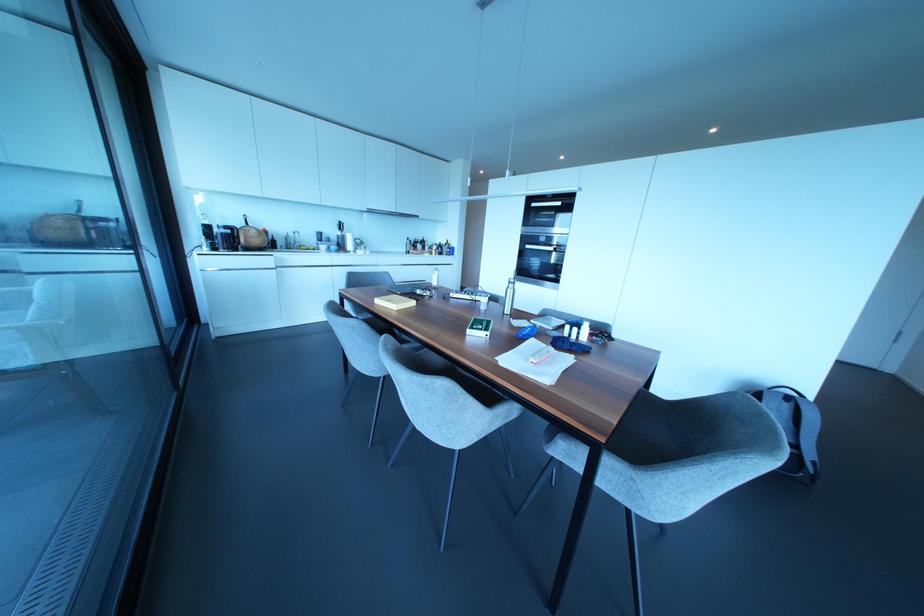
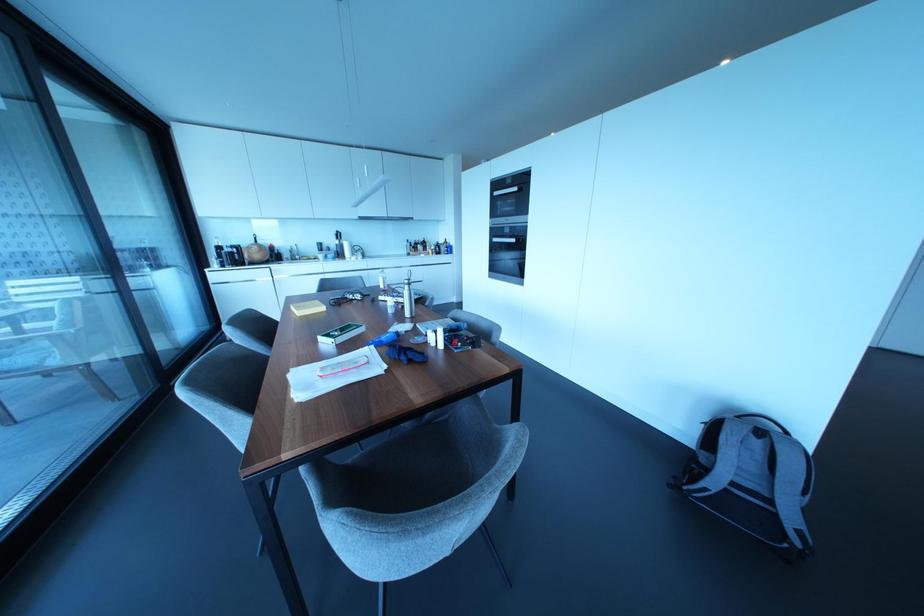
In the second image, find the point that corresponds to (527,246) in the first image.

(493, 238)